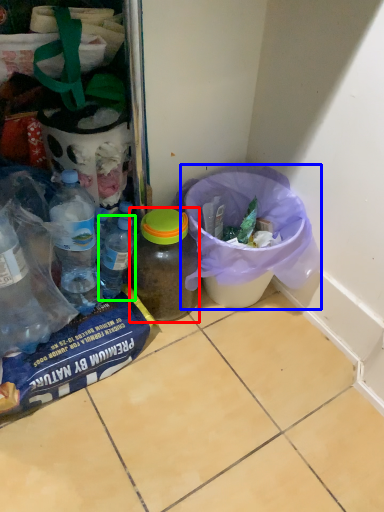
Question: Which is farther away from bottle (highlighted by a red box)? recycling bin (highlighted by a blue box) or bottle (highlighted by a green box)?

Choices:
 (A) recycling bin
 (B) bottle

Answer: (A)